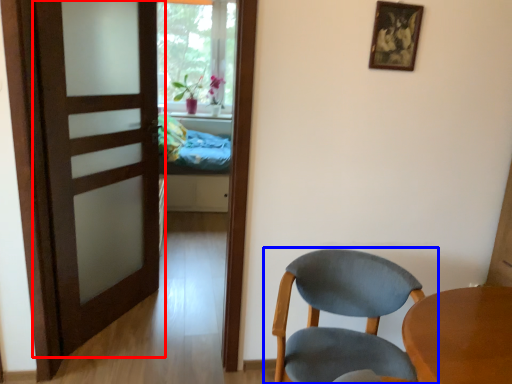
Question: Which object appears farthest to the camera in this image, door (highlighted by a red box) or chair (highlighted by a blue box)?

Choices:
 (A) door
 (B) chair

Answer: (A)